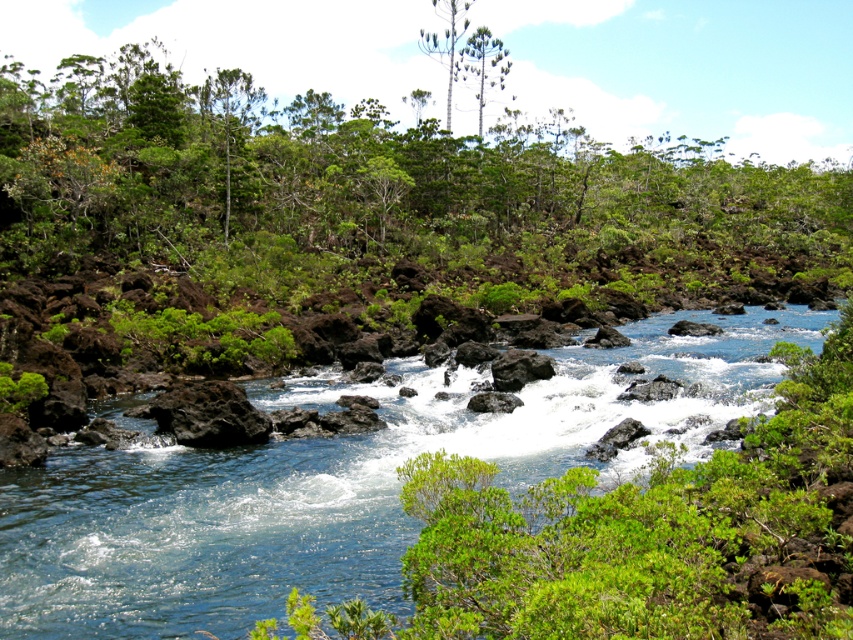
Is the position of green textured tree at upper center more distant than that of white smooth tree at upper center?

No, green textured tree at upper center is in front of white smooth tree at upper center.

Is green textured tree at upper center taller than white smooth tree at upper center?

Indeed, green textured tree at upper center has a greater height compared to white smooth tree at upper center.

From the picture: Who is more distant from viewer, (474,36) or (461,22)?

The point (461,22) is more distant.

Identify the location of green textured tree at upper center. The height and width of the screenshot is (640, 853). (482, 65).

Does point (428, 433) come behind point (442, 17)?

No, (428, 433) is closer to viewer.

Is clear blue water at center thinner than white smooth tree at upper center?

No, clear blue water at center is not thinner than white smooth tree at upper center.

You are a GUI agent. You are given a task and a screenshot of the screen. Output one action in this format:
    pyautogui.click(x=<x>, y=<y>)
    Task: Click on the clear blue water at center
    
    Given the screenshot: What is the action you would take?
    pyautogui.click(x=16, y=579)

Is clear blue water at center smaller than green textured tree at upper center?

Correct, clear blue water at center occupies less space than green textured tree at upper center.

Can you confirm if clear blue water at center is positioned to the left of green textured tree at upper center?

Indeed, clear blue water at center is positioned on the left side of green textured tree at upper center.

Is point (334, 483) positioned before point (503, 65)?

Yes, point (334, 483) is closer to viewer.

This screenshot has width=853, height=640. Find the location of `clear blue water at center`. clear blue water at center is located at coordinates (16, 579).